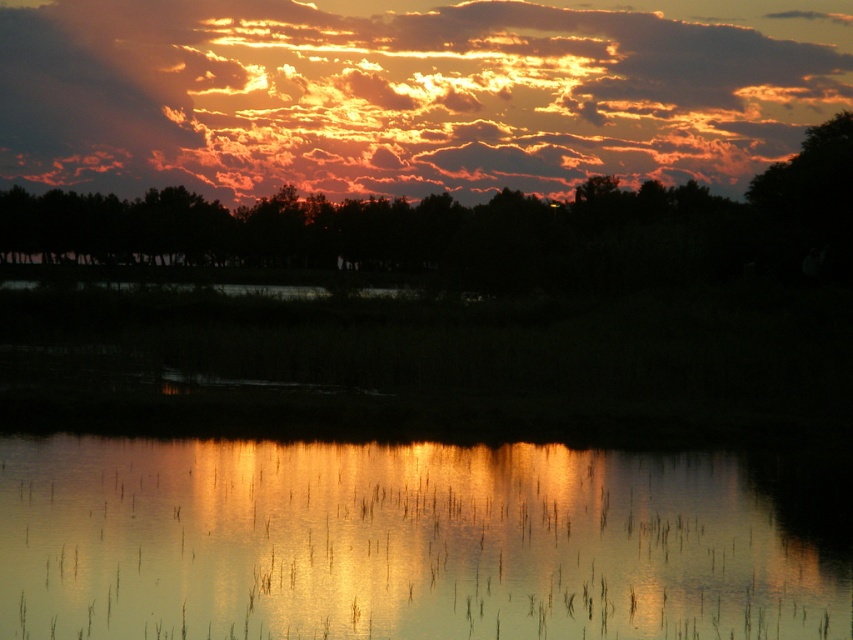
Is point (706, 561) closer to viewer compared to point (450, 84)?

Yes, it is in front of point (450, 84).

Is the position of glistening water at center more distant than that of golden textured clouds at upper center?

No.

The image size is (853, 640). What do you see at coordinates (408, 541) in the screenshot?
I see `glistening water at center` at bounding box center [408, 541].

This screenshot has width=853, height=640. Find the location of `glistening water at center`. glistening water at center is located at coordinates (408, 541).

Is glistening water at center taller than dark green leafy tree at center?

No.

Is point (163, 563) less distant than point (531, 273)?

Yes, it is.

Is point (134, 467) farther from camera compared to point (482, 230)?

That is False.

Find the location of a particular element. glistening water at center is located at coordinates (408, 541).

What do you see at coordinates (410, 92) in the screenshot? This screenshot has width=853, height=640. I see `golden textured clouds at upper center` at bounding box center [410, 92].

Can you confirm if golden textured clouds at upper center is taller than dark green leafy tree at center?

Correct, golden textured clouds at upper center is much taller as dark green leafy tree at center.

Who is more forward, (279,68) or (759,243)?

Point (759,243) is in front.

At what (x,y) coordinates should I click in order to perform the action: click on golden textured clouds at upper center. Please return your answer as a coordinate pair (x, y). The width and height of the screenshot is (853, 640). Looking at the image, I should click on (410, 92).